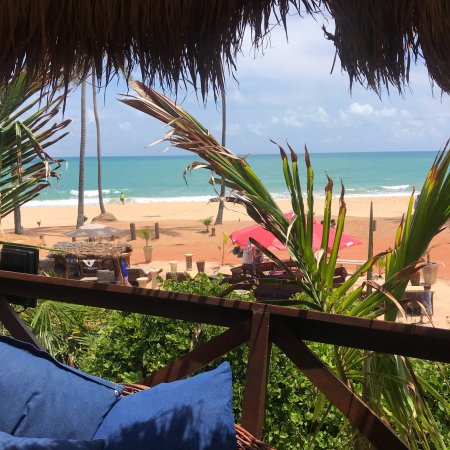
Image resolution: width=450 pixels, height=450 pixels. I want to click on cloth, so click(55, 394).